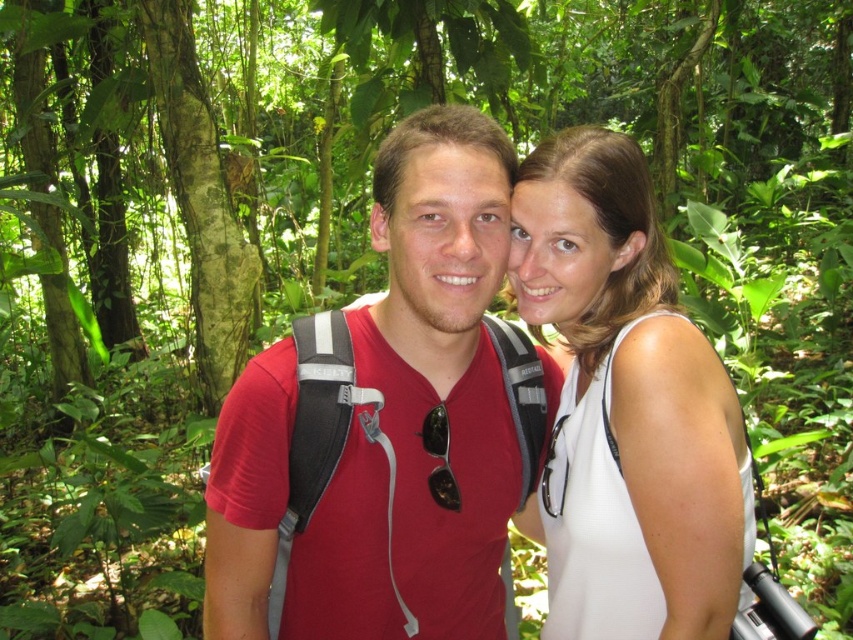
Question: Is matte red shirt at center smaller than white matte tank top at center?

Choices:
 (A) yes
 (B) no

Answer: (A)

Question: Observing the image, what is the correct spatial positioning of matte red shirt at center in reference to white matte tank top at center?

Choices:
 (A) left
 (B) right

Answer: (A)

Question: Which point is farther to the camera?

Choices:
 (A) matte red shirt at center
 (B) white matte tank top at center

Answer: (B)

Question: Which object appears farthest from the camera in this image?

Choices:
 (A) matte red shirt at center
 (B) white matte tank top at center

Answer: (B)

Question: Which object appears closest to the camera in this image?

Choices:
 (A) white matte tank top at center
 (B) matte red shirt at center

Answer: (B)

Question: Does matte red shirt at center appear on the left side of white matte tank top at center?

Choices:
 (A) no
 (B) yes

Answer: (B)